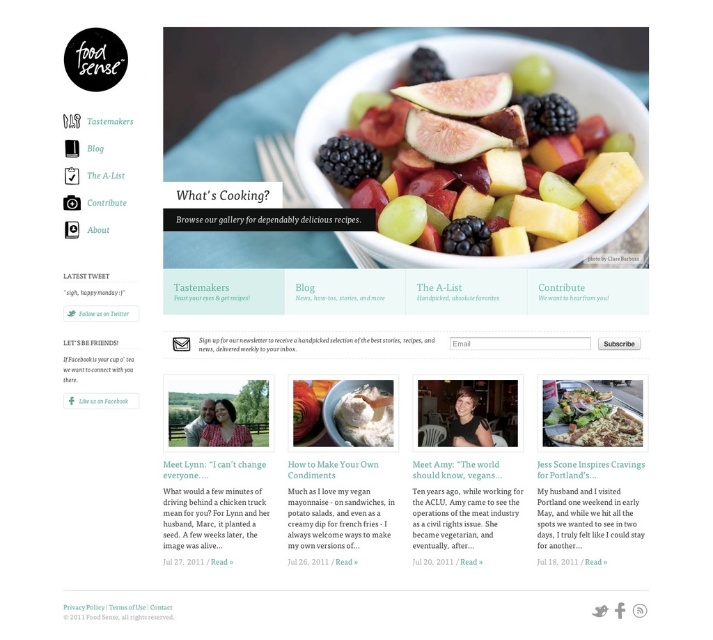
You are designing a webpage layout for a food blog and need to place a matte white bowl at center and a camera icon. The camera icon must be placed exactly 40 inches away from the bowl. Based on the current arrangement, will the camera icon need to be moved to comply with this requirement?

The matte white bowl at center and camera are currently 39.21 inches apart. Since the required distance is 40 inches, the camera icon needs to be moved approximately 0.79 inches further away from the bowl to meet the requirement.

You are a web designer trying to place a new button on the webpage. The button needs to be placed exactly at the point with coordinates point (584, 116). According to the webpage layout, where will this button be placed?

The point (584, 116) is on the matte white bowl at center, so placing the button there would position it on the matte white bowl at center.

You are designing a webpage layout for Food Sense. You have a green leafy salad at center and a white fluffy cloud at center. Which object should be placed closer to the viewer to ensure proper visual hierarchy?

The green leafy salad at center should be placed closer to the viewer since it is in front of the white fluffy cloud at center, creating a clear visual hierarchy.